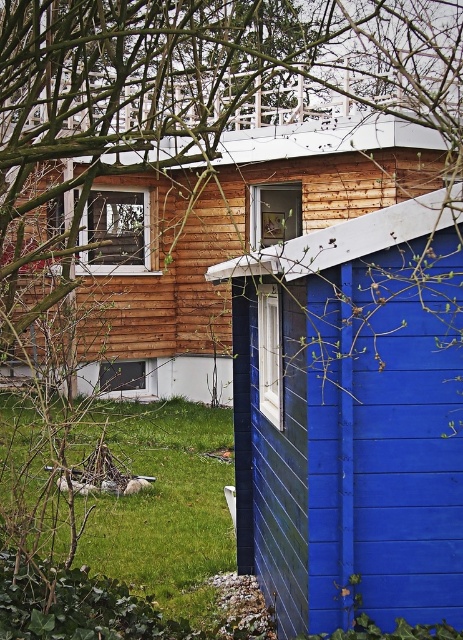
Is wooden cabin at center shorter than green grass at lower left?

Yes, wooden cabin at center is shorter than green grass at lower left.

Measure the distance from wooden cabin at center to green grass at lower left.

wooden cabin at center is 6.39 meters from green grass at lower left.

Image resolution: width=463 pixels, height=640 pixels. Find the location of `wooden cabin at center`. wooden cabin at center is located at coordinates (227, 234).

Is point (421, 560) positioned in front of point (8, 492)?

Yes, point (421, 560) is closer to viewer.

Does blue wooden shed at right have a greater width compared to green grass at lower left?

Incorrect, blue wooden shed at right's width does not surpass green grass at lower left's.

In order to click on blue wooden shed at right in this screenshot , I will do click(351, 419).

Identify the location of blue wooden shed at right. The image size is (463, 640). (351, 419).